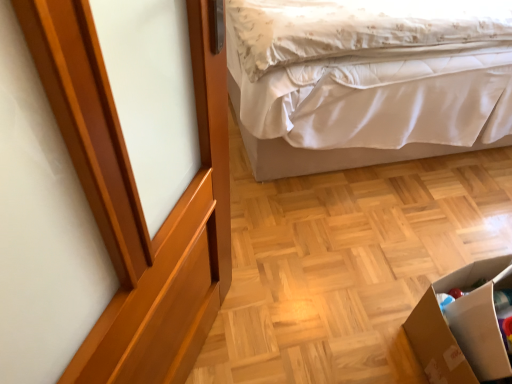
Where is `free space to the back side of glossy wood screen door at upper left`? Image resolution: width=512 pixels, height=384 pixels. free space to the back side of glossy wood screen door at upper left is located at coordinates (265, 248).